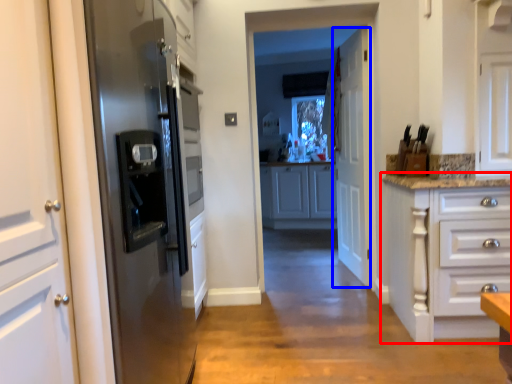
Question: Among these objects, which one is nearest to the camera, cabinetry (highlighted by a red box) or door (highlighted by a blue box)?

Choices:
 (A) cabinetry
 (B) door

Answer: (A)